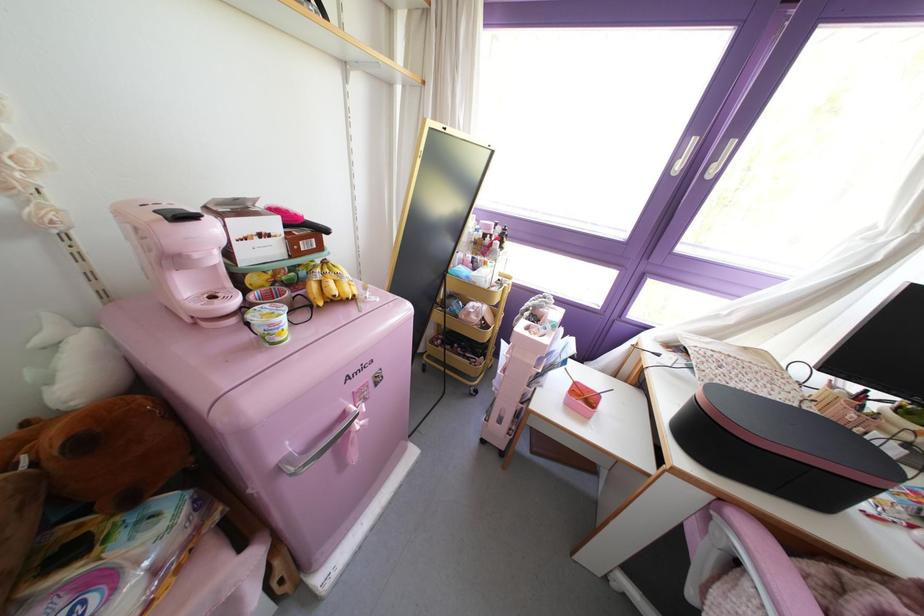
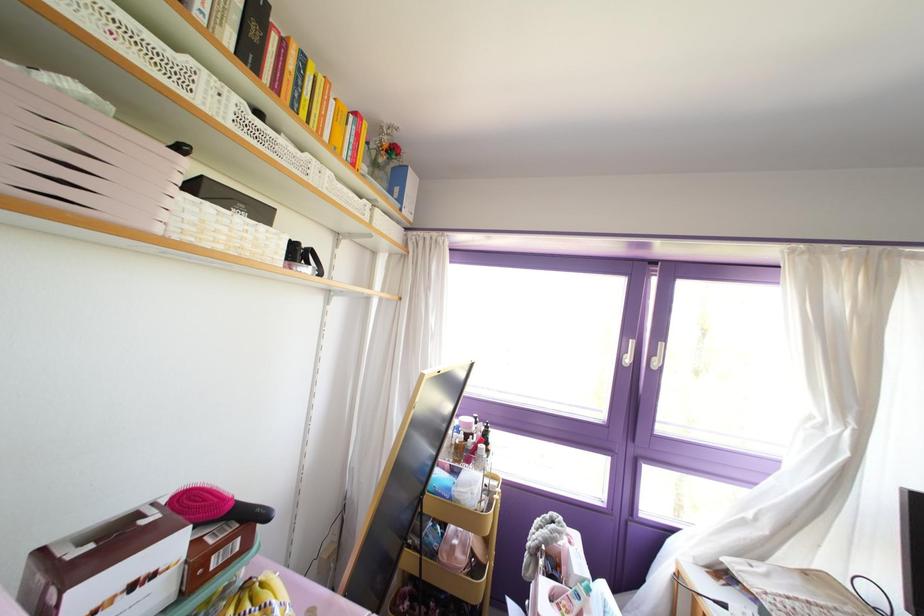
Locate, in the second image, the point that corresponds to point 318,230 in the first image.

(251, 517)